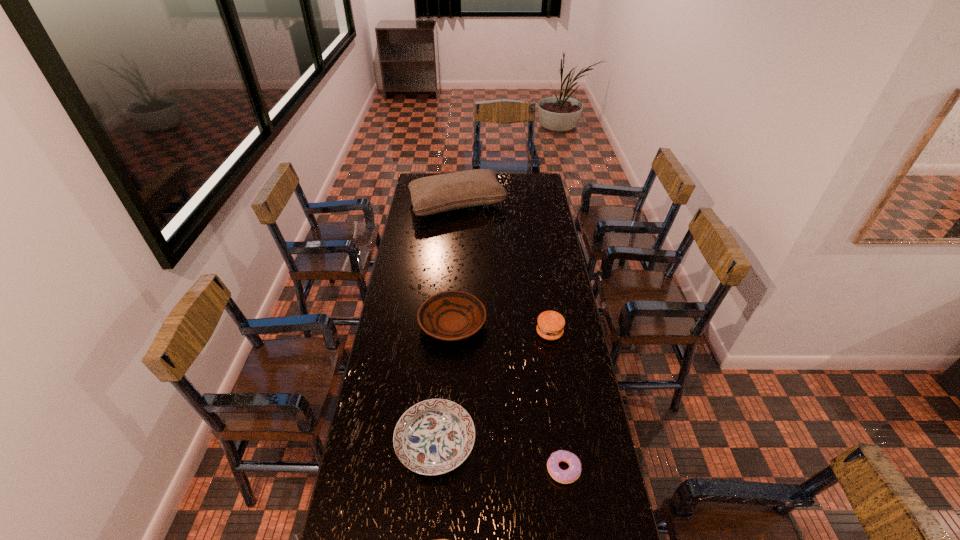
Image resolution: width=960 pixels, height=540 pixels. I want to click on vacant space that is in between the doughnut and the second nearest plate, so click(499, 455).

The width and height of the screenshot is (960, 540). I want to click on unoccupied area between the fourth shortest object and the doughnut, so click(x=508, y=396).

What are the coordinates of `free space that is in between the patty and the tallest object` in the screenshot? It's located at (504, 269).

Locate an element on the screen. This screenshot has width=960, height=540. free point between the second tallest object and the second tallest plate is located at coordinates (492, 387).

Find the location of a particular element. vacant region between the doughnut and the second farthest plate is located at coordinates (499, 455).

This screenshot has width=960, height=540. I want to click on free point between the doughnut and the farthest object, so [511, 337].

The height and width of the screenshot is (540, 960). What are the coordinates of `object that stands as the closest to the doughnut` in the screenshot? It's located at (433, 437).

Locate which object ranks in proximity to the farthest plate. Please provide its 2D coordinates. Your answer should be formatted as a tuple, i.e. [(x, y)], where the tuple contains the x and y coordinates of a point satisfying the conditions above.

[(550, 325)]

Identify the location of the closest plate relative to the shortest object. (433, 437).

The height and width of the screenshot is (540, 960). Find the location of `plate that is the second closest to the farthest object`. plate that is the second closest to the farthest object is located at coordinates (433, 437).